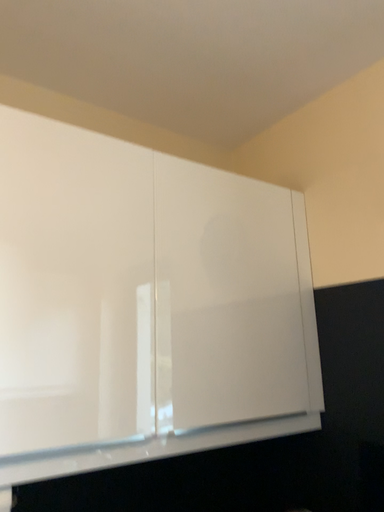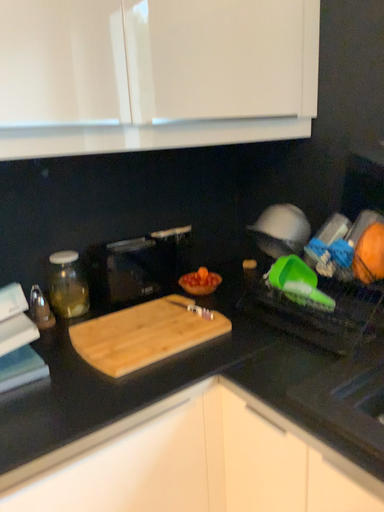
Question: How did the camera likely rotate when shooting the video?

Choices:
 (A) rotated upward
 (B) rotated downward

Answer: (B)